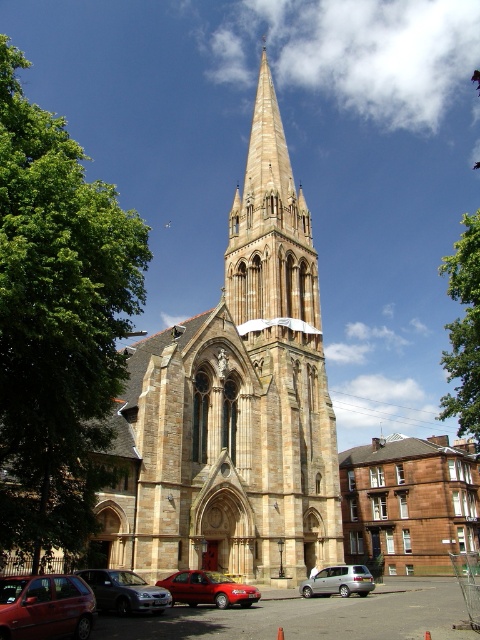
You are a delivery driver who needs to park your truck that is 2 meters wide. You see the shiny red sedan at center and the silver metallic van at lower center in the parking lot. Which vehicle can you park next to without overlapping?

The shiny red sedan at center has a lesser width compared to silver metallic van at lower center, so the shiny red sedan at center is narrower. Since your truck is 2 meters wide, you can park next to the shiny red sedan at center as it has enough space, but the silver metallic van at lower center is wider and may not leave enough space.

You are standing in front of the historic church and notice two points marked on the spire. The first point is at coordinates point (36,461) and the second is at point (477,358). Which of these two points is physically closer to you as you face the church?

Point (36,461) is closer to the camera than point (477,358), so the first point is physically closer to you as you face the church.

You are standing in front of the historic church and want to take a photo that includes both the green leafy tree at left and the church spire. Given that the tree is 28.96 meters away from you, will you need to adjust your camera angle to ensure both are in frame?

The green leafy tree at left is 28.96 meters away from the camera. Since the tree is positioned at the left and the spire is part of the church structure in front of you, you can likely capture both by adjusting your camera angle slightly to include the tree while keeping the spire centered. However, the exact adjustment depends on your camera lens and field of view.